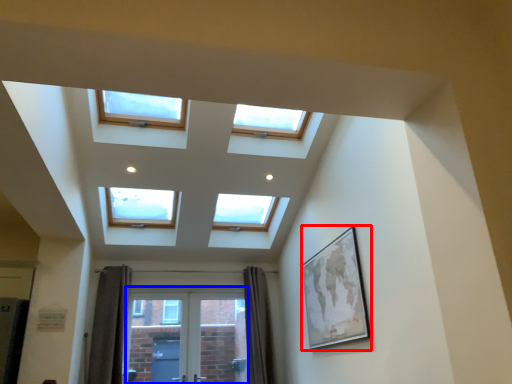
Question: Which point is closer to the camera, picture frame (highlighted by a red box) or screen door (highlighted by a blue box)?

Choices:
 (A) picture frame
 (B) screen door

Answer: (A)